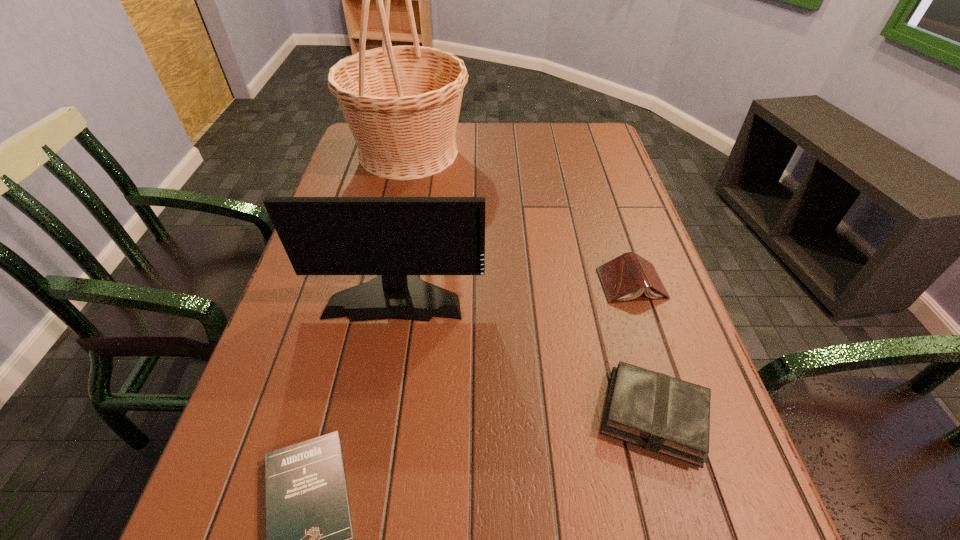
You are a GUI agent. You are given a task and a screenshot of the screen. Output one action in this format:
    pyautogui.click(x=<x>, y=<y>)
    Task: Click on the object that is the second closest to the fourth shortest object
    
    Given the screenshot: What is the action you would take?
    pyautogui.click(x=309, y=534)

This screenshot has height=540, width=960. In order to click on book identified as the closest to the farthest book in this screenshot , I will do `click(660, 413)`.

Identify which book is located as the second nearest to the basket. Please provide its 2D coordinates. Your answer should be formatted as a tuple, i.e. [(x, y)], where the tuple contains the x and y coordinates of a point satisfying the conditions above.

[(660, 413)]